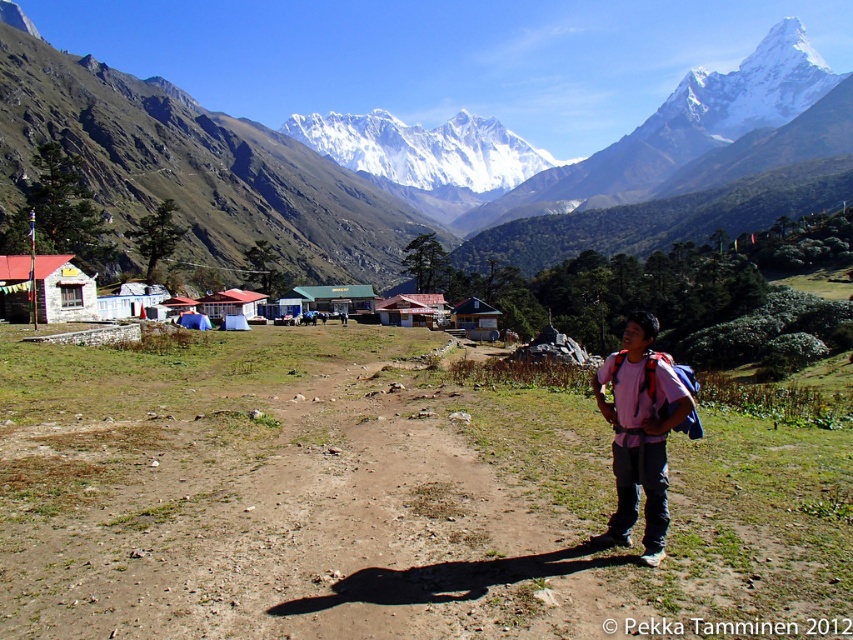
You are a hiker standing on the dirt path and looking at the snowy granite mountain range at upper center and the pink fabric backpack at center. Which object is higher in the image?

The snowy granite mountain range at upper center is higher in the image because it is positioned above the pink fabric backpack at center.